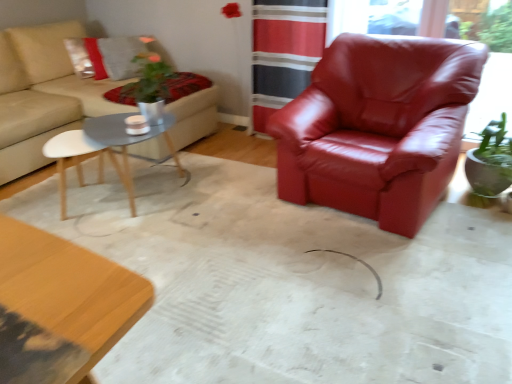
Question: From a real-world perspective, does matte gray wood coffee table at center-left stand above velvet red blanket at upper left?

Choices:
 (A) no
 (B) yes

Answer: (A)

Question: Is matte gray wood coffee table at center-left outside velvet red blanket at upper left?

Choices:
 (A) no
 (B) yes

Answer: (B)

Question: Does matte gray wood coffee table at center-left have a lesser width compared to velvet red blanket at upper left?

Choices:
 (A) yes
 (B) no

Answer: (B)

Question: From a real-world perspective, is matte gray wood coffee table at center-left located beneath velvet red blanket at upper left?

Choices:
 (A) yes
 (B) no

Answer: (A)

Question: From the image's perspective, would you say matte gray wood coffee table at center-left is positioned over velvet red blanket at upper left?

Choices:
 (A) no
 (B) yes

Answer: (A)

Question: Is matte gray wood coffee table at center-left to the right of velvet red blanket at upper left from the viewer's perspective?

Choices:
 (A) no
 (B) yes

Answer: (A)

Question: Is velvet red blanket at upper left bigger than glossy leather armchair at right?

Choices:
 (A) no
 (B) yes

Answer: (A)

Question: From a real-world perspective, is velvet red blanket at upper left under glossy leather armchair at right?

Choices:
 (A) no
 (B) yes

Answer: (B)

Question: Is velvet red blanket at upper left completely or partially outside of glossy leather armchair at right?

Choices:
 (A) yes
 (B) no

Answer: (A)

Question: Considering the relative positions of velvet red blanket at upper left and glossy leather armchair at right in the image provided, is velvet red blanket at upper left behind glossy leather armchair at right?

Choices:
 (A) yes
 (B) no

Answer: (A)

Question: From the image's perspective, is velvet red blanket at upper left beneath glossy leather armchair at right?

Choices:
 (A) no
 (B) yes

Answer: (A)

Question: From the image's perspective, is velvet red blanket at upper left above glossy leather armchair at right?

Choices:
 (A) yes
 (B) no

Answer: (A)

Question: Is matte gray wood coffee table at center-left facing away from glossy leather armchair at right?

Choices:
 (A) no
 (B) yes

Answer: (A)